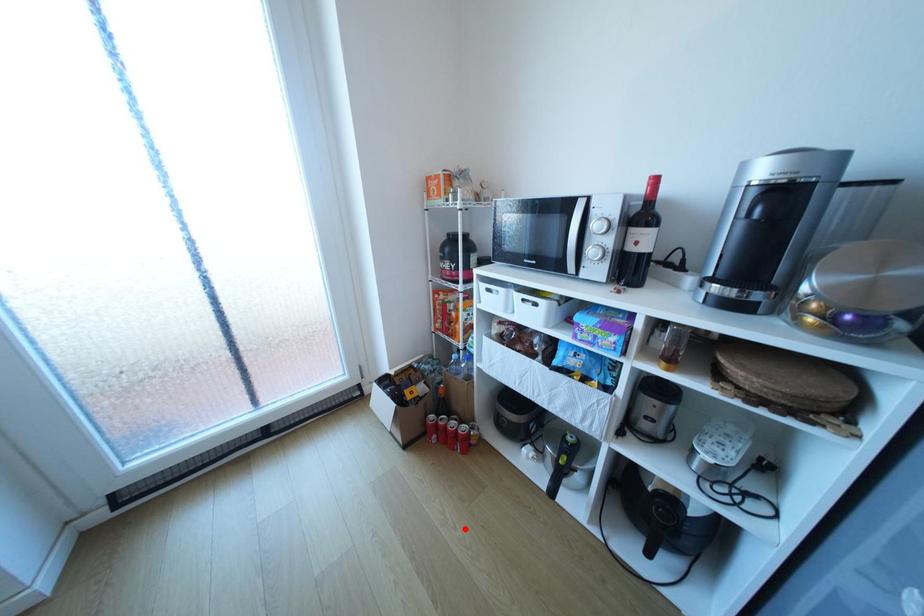
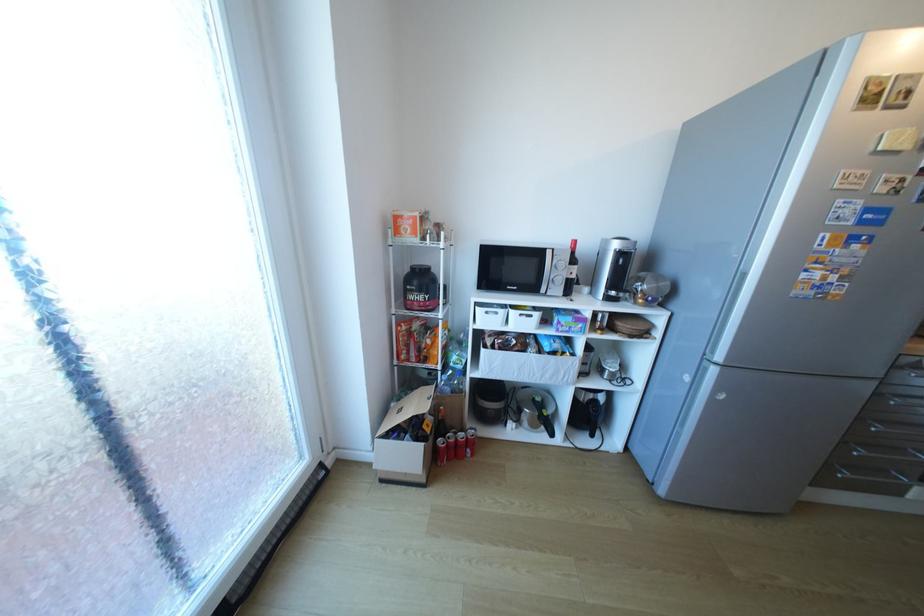
The point at the highlighted location is marked in the first image. Where is the corresponding point in the second image?

(523, 504)